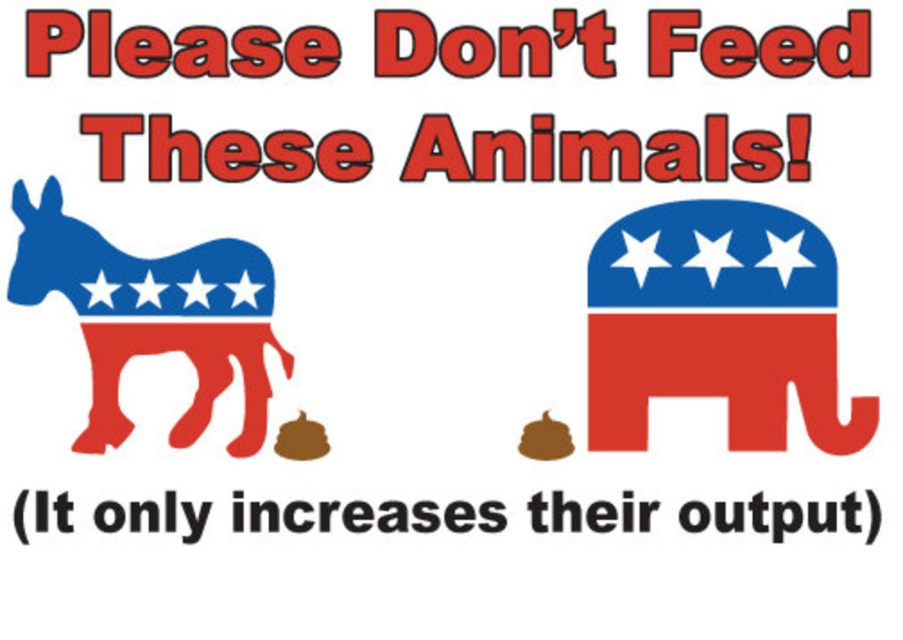
Question: Is matte plastic elephant at center to the right of black paper at center from the viewer's perspective?

Choices:
 (A) yes
 (B) no

Answer: (A)

Question: Is blue and white painted donkey at left wider than black paper at center?

Choices:
 (A) no
 (B) yes

Answer: (A)

Question: Which point appears closest to the camera in this image?

Choices:
 (A) (803, 264)
 (B) (116, 362)
 (C) (67, 531)

Answer: (B)

Question: Does matte plastic elephant at center have a smaller size compared to black paper at center?

Choices:
 (A) no
 (B) yes

Answer: (A)

Question: Considering the real-world distances, which object is closest to the matte plastic elephant at center?

Choices:
 (A) black paper at center
 (B) blue and white painted donkey at left

Answer: (A)

Question: Which of the following is the farthest from the observer?

Choices:
 (A) (442, 512)
 (B) (141, 330)
 (C) (760, 273)

Answer: (C)